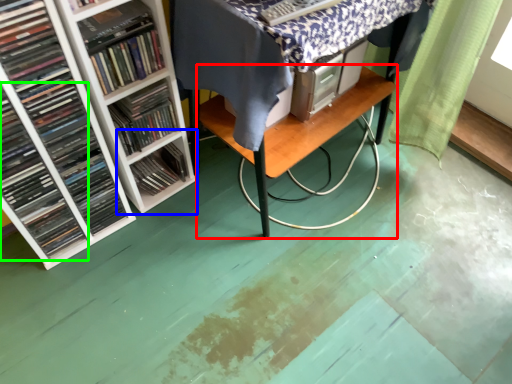
Question: Based on their relative distances, which object is farther from table (highlighted by a red box)? Choose from shelf (highlighted by a blue box) and book (highlighted by a green box).

Choices:
 (A) shelf
 (B) book

Answer: (B)